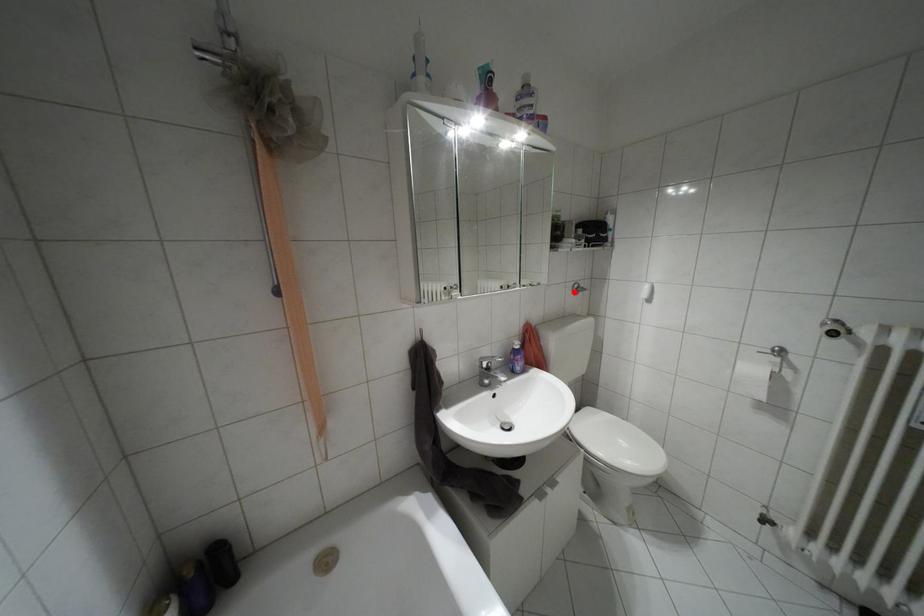
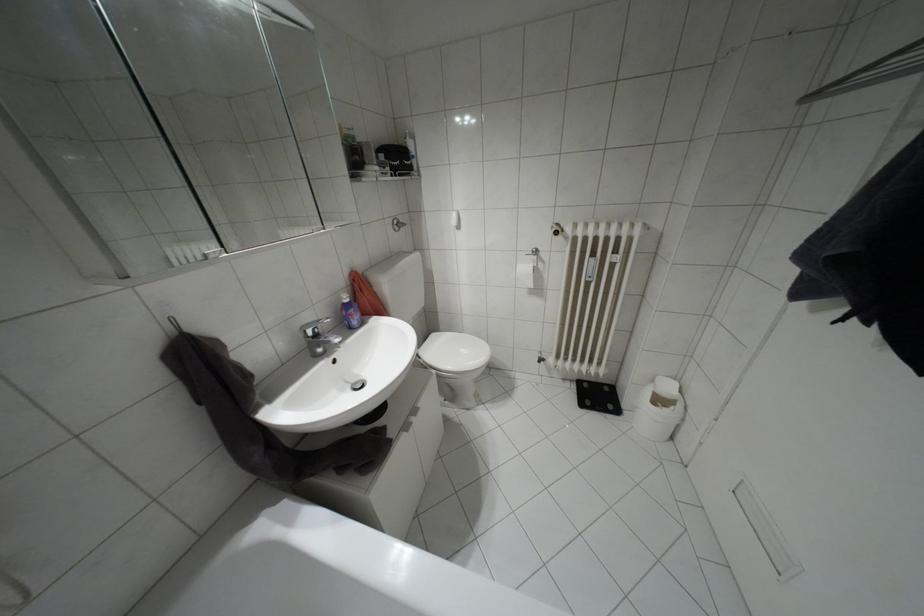
The point at the highlighted location is marked in the first image. Where is the corresponding point in the second image?

(395, 229)